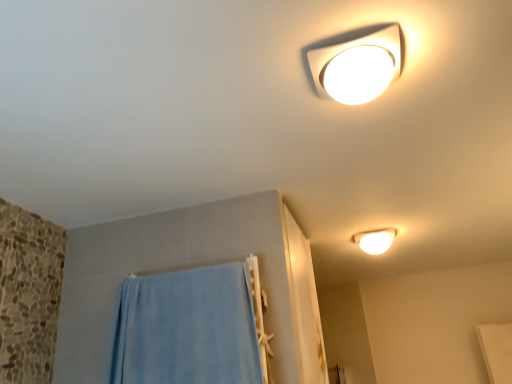
Question: Is blue soft towel at lower left oriented towards white glossy lamp at upper center, which ranks as the 1th lamp in front-to-back order?

Choices:
 (A) no
 (B) yes

Answer: (A)

Question: Is blue soft towel at lower left smaller than white glossy lamp at upper center, which is the first lamp in left-to-right order?

Choices:
 (A) yes
 (B) no

Answer: (B)

Question: Does blue soft towel at lower left have a larger size compared to white glossy lamp at upper center, the 2th lamp positioned from the right?

Choices:
 (A) no
 (B) yes

Answer: (B)

Question: Considering the relative positions of blue soft towel at lower left and white glossy lamp at upper center, which is the first lamp in left-to-right order, in the image provided, is blue soft towel at lower left to the right of white glossy lamp at upper center, which is the first lamp in left-to-right order, from the viewer's perspective?

Choices:
 (A) no
 (B) yes

Answer: (A)

Question: From a real-world perspective, does blue soft towel at lower left sit lower than white glossy lamp at upper center, which is the first lamp in left-to-right order?

Choices:
 (A) yes
 (B) no

Answer: (A)

Question: From a real-world perspective, is blue soft towel at lower left located higher than white glossy lamp at upper center, acting as the second lamp starting from the back?

Choices:
 (A) yes
 (B) no

Answer: (B)

Question: From the image's perspective, is blue soft towel at lower left beneath white glossy light fixture at upper right, positioned as the 1th lamp in back-to-front order?

Choices:
 (A) no
 (B) yes

Answer: (B)

Question: Is blue soft towel at lower left not near white glossy light fixture at upper right, acting as the first lamp starting from the right?

Choices:
 (A) no
 (B) yes

Answer: (B)

Question: Is blue soft towel at lower left bigger than white glossy light fixture at upper right, the 1th lamp from the bottom?

Choices:
 (A) yes
 (B) no

Answer: (A)

Question: Can you confirm if blue soft towel at lower left is positioned to the right of white glossy light fixture at upper right, which is counted as the 2th lamp, starting from the top?

Choices:
 (A) no
 (B) yes

Answer: (A)

Question: From a real-world perspective, is blue soft towel at lower left under white glossy light fixture at upper right, which ranks as the 2th lamp in left-to-right order?

Choices:
 (A) yes
 (B) no

Answer: (A)

Question: Is blue soft towel at lower left thinner than white glossy light fixture at upper right, the 1th lamp from the bottom?

Choices:
 (A) no
 (B) yes

Answer: (B)

Question: Is white glossy lamp at upper center, the 2th lamp positioned from the right, to the left of white glossy light fixture at upper right, positioned as the 1th lamp in back-to-front order, from the viewer's perspective?

Choices:
 (A) no
 (B) yes

Answer: (B)